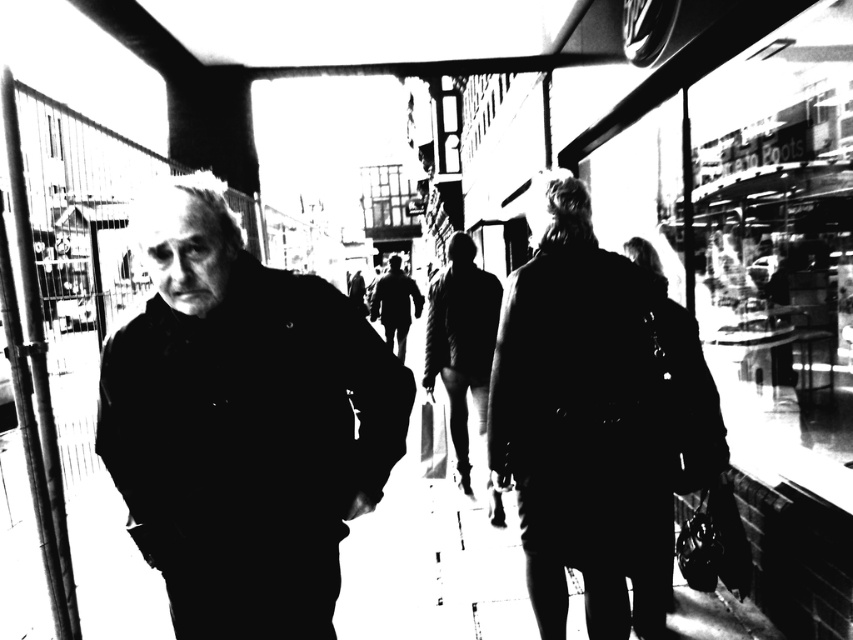
Question: Among these objects, which one is farthest from the camera?

Choices:
 (A) dark textured coat at center
 (B) dark matte jacket at center

Answer: (A)

Question: Is dark matte jacket at center positioned behind smooth leather jacket at center?

Choices:
 (A) yes
 (B) no

Answer: (B)

Question: Which object appears farthest from the camera in this image?

Choices:
 (A) dark matte jacket at center
 (B) silky black coat at center
 (C) smooth leather jacket at center
 (D) dark textured coat at center

Answer: (C)

Question: Which object appears closest to the camera in this image?

Choices:
 (A) dark matte jacket at center
 (B) silky black coat at center

Answer: (A)

Question: Does silky black coat at center appear on the right side of dark textured coat at center?

Choices:
 (A) yes
 (B) no

Answer: (A)

Question: Can you confirm if dark matte jacket at center is positioned below smooth leather jacket at center?

Choices:
 (A) yes
 (B) no

Answer: (B)